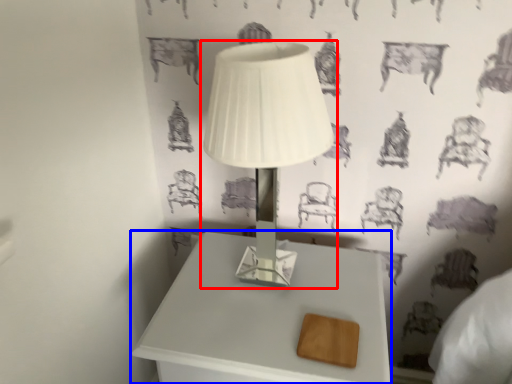
Question: Which object is closer to the camera taking this photo, lamp (highlighted by a red box) or table (highlighted by a blue box)?

Choices:
 (A) lamp
 (B) table

Answer: (A)